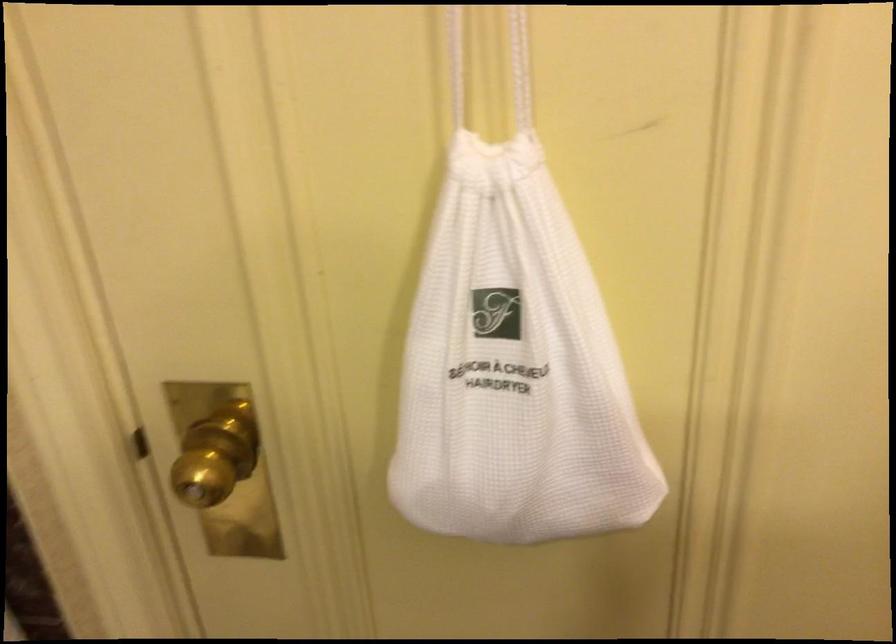
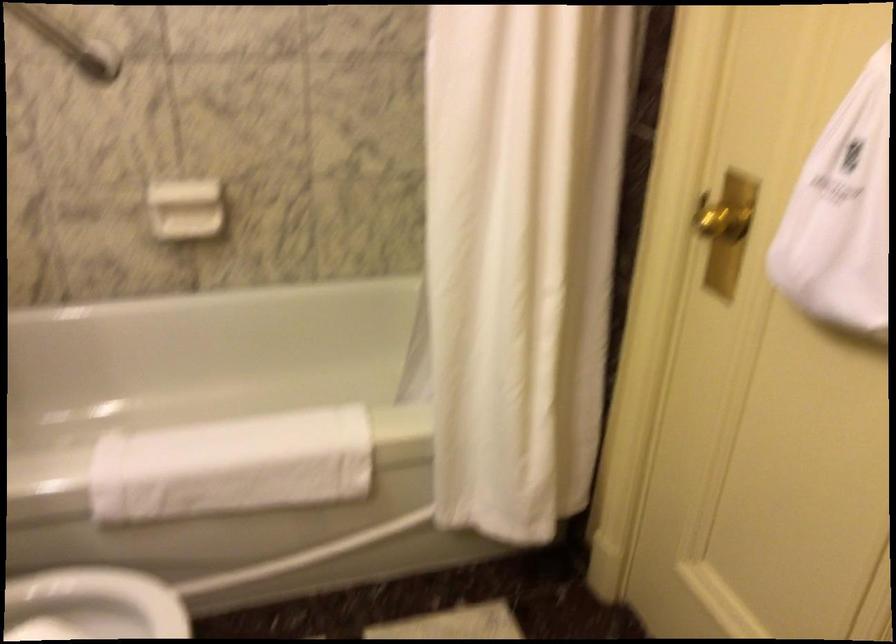
Find the pixel in the second image that matches (x=504, y=419) in the first image.

(841, 214)